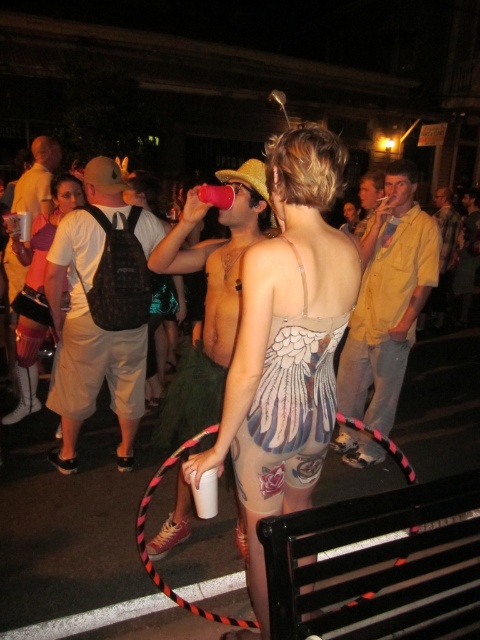
This screenshot has width=480, height=640. Describe the element at coordinates (287, 344) in the screenshot. I see `matte metallic dress at center` at that location.

Can you confirm if matte metallic dress at center is positioned above white cotton t-shirt at left?

Actually, matte metallic dress at center is below white cotton t-shirt at left.

This screenshot has height=640, width=480. Identify the location of matte metallic dress at center. coord(287,344).

The height and width of the screenshot is (640, 480). Identify the location of matte metallic dress at center. (287, 344).